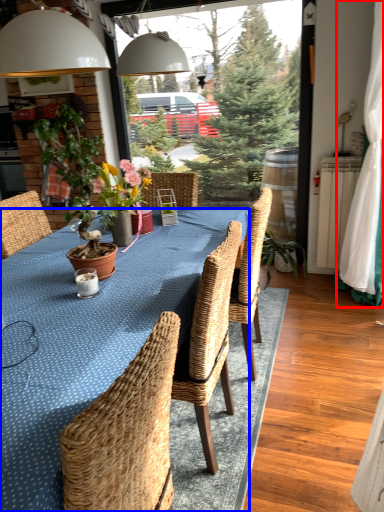
Question: Among these objects, which one is nearest to the camera, curtain (highlighted by a red box) or kitchen & dining room table (highlighted by a blue box)?

Choices:
 (A) curtain
 (B) kitchen & dining room table

Answer: (B)